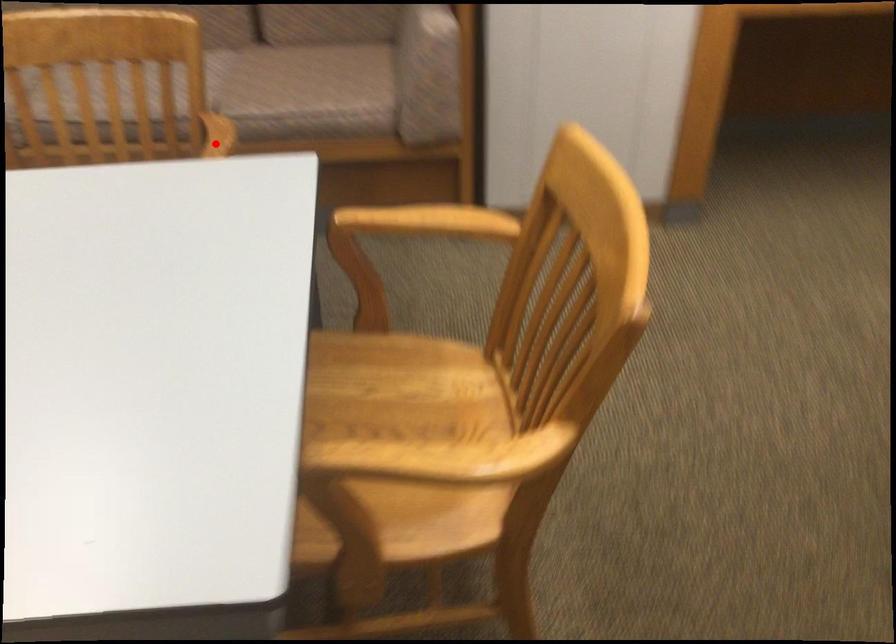
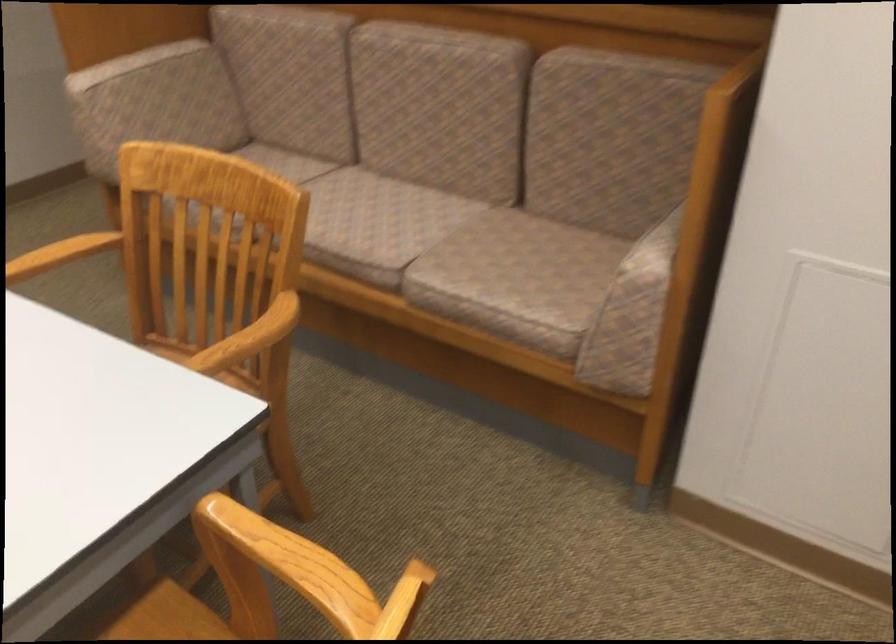
In the second image, find the point that corresponds to the highlighted location in the first image.

(248, 339)